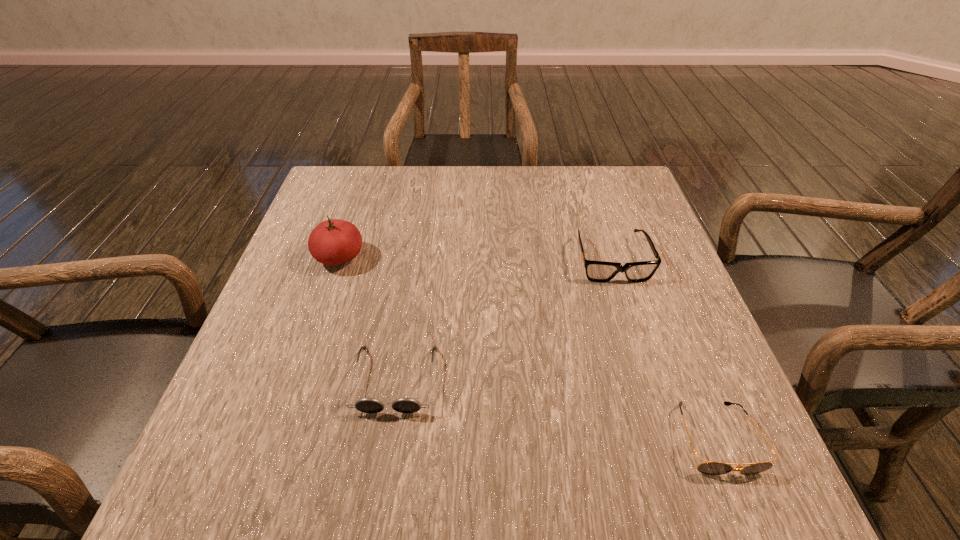
The height and width of the screenshot is (540, 960). I want to click on the leftmost object, so click(332, 242).

Where is `tomato`? Image resolution: width=960 pixels, height=540 pixels. tomato is located at coordinates (332, 242).

I want to click on the tallest sunglasses, so click(x=596, y=271).

You are a GUI agent. You are given a task and a screenshot of the screen. Output one action in this format:
    pyautogui.click(x=<x>, y=<y>)
    Task: Click on the farthest sunglasses
    
    Given the screenshot: What is the action you would take?
    pyautogui.click(x=596, y=271)

This screenshot has width=960, height=540. What are the coordinates of `the leftmost sunglasses` in the screenshot? It's located at (405, 405).

This screenshot has width=960, height=540. I want to click on vacant space located 0.290m on the right of the leftmost object, so click(x=491, y=258).

Find the location of a particular element. The height and width of the screenshot is (540, 960). free spot located on the front-facing side of the farthest sunglasses is located at coordinates (624, 302).

Image resolution: width=960 pixels, height=540 pixels. What are the coordinates of `vacant region located on the front-facing side of the third object from right to left` in the screenshot? It's located at (381, 469).

Identify the location of object positioned at the near edge. This screenshot has height=540, width=960. (709, 468).

At what (x,y) coordinates should I click in order to perform the action: click on object at the left edge. Please return your answer as a coordinate pair (x, y). Looking at the image, I should click on (332, 242).